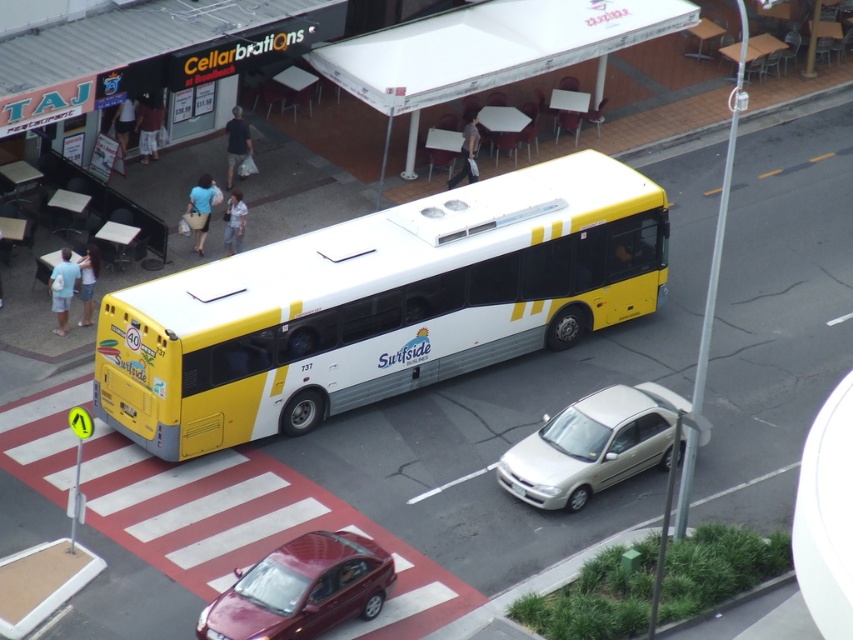
Does yellow matte bus at center have a lesser width compared to white fabric canopy at upper center?

Incorrect, yellow matte bus at center's width is not less than white fabric canopy at upper center's.

Which of these two, yellow matte bus at center or white fabric canopy at upper center, stands taller?

Standing taller between the two is yellow matte bus at center.

Which is behind, point (521, 317) or point (421, 58)?

Positioned behind is point (421, 58).

This screenshot has width=853, height=640. Find the location of `yellow matte bus at center`. yellow matte bus at center is located at coordinates (379, 305).

At what (x,y) coordinates should I click in order to perform the action: click on white fabric canopy at upper center. Please return your answer as a coordinate pair (x, y). The width and height of the screenshot is (853, 640). Looking at the image, I should click on (489, 45).

Identify the location of white fabric canopy at upper center. This screenshot has width=853, height=640. (489, 45).

Where is `white fabric canopy at upper center`? This screenshot has width=853, height=640. white fabric canopy at upper center is located at coordinates (489, 45).

Between yellow matte bus at center and silver metallic sedan at center-right, which one appears on the right side from the viewer's perspective?

Positioned to the right is silver metallic sedan at center-right.

Is yellow matte bus at center positioned at the back of silver metallic sedan at center-right?

No, it is in front of silver metallic sedan at center-right.

What do you see at coordinates (379, 305) in the screenshot?
I see `yellow matte bus at center` at bounding box center [379, 305].

Image resolution: width=853 pixels, height=640 pixels. In order to click on yellow matte bus at center in this screenshot , I will do `click(379, 305)`.